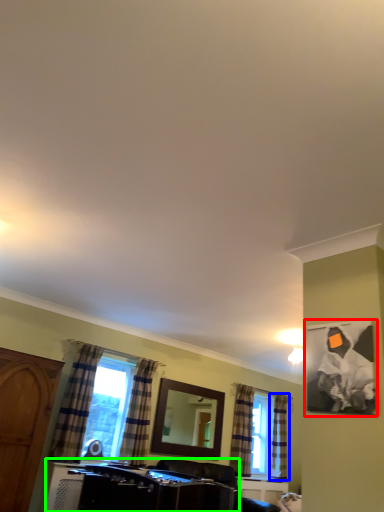
Question: Based on their relative distances, which object is nearer to picture frame (highlighted by a red box)? Choose from curtain (highlighted by a blue box) and vanity (highlighted by a green box).

Choices:
 (A) curtain
 (B) vanity

Answer: (B)